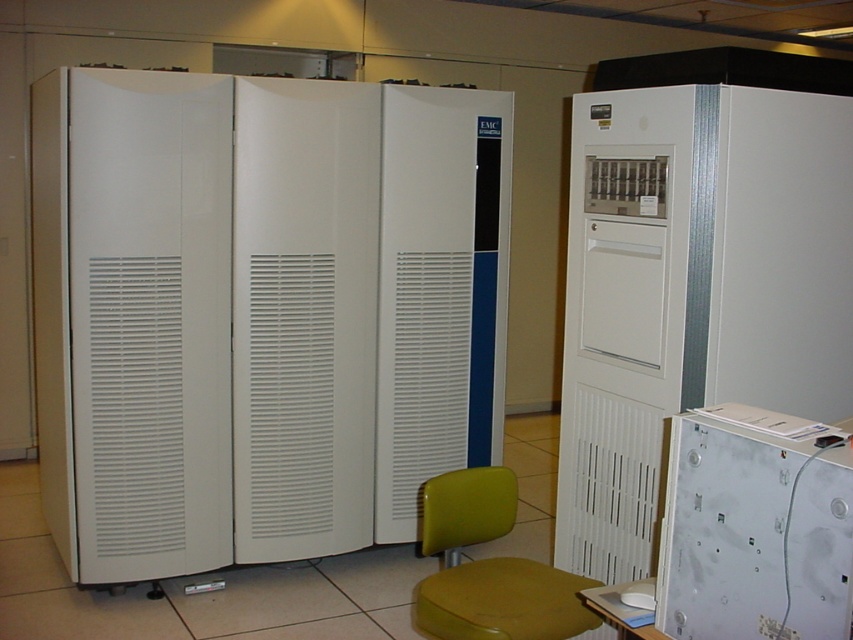
Does white plastic cabinet at lower right appear on the left side of green plastic chair at center?

In fact, white plastic cabinet at lower right is to the right of green plastic chair at center.

Which is behind, point (763, 442) or point (566, 572)?

Positioned behind is point (566, 572).

Locate an element on the screen. white plastic cabinet at lower right is located at coordinates (752, 536).

Can you confirm if white matte refrigerator at center is positioned below white plastic cabinet at lower right?

No.

Which of these two, white matte refrigerator at center or white plastic cabinet at lower right, stands shorter?

white plastic cabinet at lower right

This screenshot has height=640, width=853. I want to click on white matte refrigerator at center, so click(x=260, y=312).

Is white plastic cabinet at lower right wider than yellow plastic stool at center?

No, white plastic cabinet at lower right is not wider than yellow plastic stool at center.

Who is positioned more to the right, white plastic cabinet at lower right or yellow plastic stool at center?

white plastic cabinet at lower right

Between point (699, 496) and point (512, 632), which one is positioned behind?

Positioned behind is point (512, 632).

The width and height of the screenshot is (853, 640). I want to click on white plastic cabinet at lower right, so click(x=752, y=536).